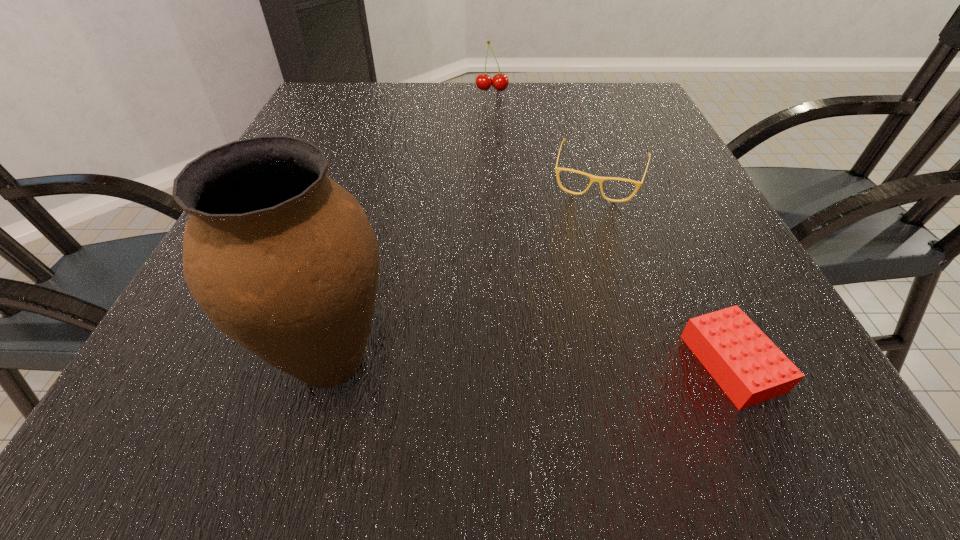
The image size is (960, 540). Find the location of `empty location between the third object from right to left and the second farthest object`. empty location between the third object from right to left and the second farthest object is located at coordinates (546, 133).

You are a GUI agent. You are given a task and a screenshot of the screen. Output one action in this format:
    pyautogui.click(x=<x>, y=<y>)
    Task: Click on the free space between the Lego and the leftmost object
    The width and height of the screenshot is (960, 540).
    Given the screenshot: What is the action you would take?
    pyautogui.click(x=531, y=361)

Where is `free space between the leftmost object and the farthest object`? free space between the leftmost object and the farthest object is located at coordinates (412, 225).

Identify the location of free area in between the farthest object and the third nearest object. (546, 133).

Image resolution: width=960 pixels, height=540 pixels. I want to click on empty space that is in between the cherry and the Lego, so click(x=612, y=226).

At what (x,y) coordinates should I click in order to perform the action: click on free area in between the tallest object and the cherry. Please return your answer as a coordinate pair (x, y). Looking at the image, I should click on (412, 225).

The image size is (960, 540). What are the coordinates of `empty location between the Lego and the urn` in the screenshot? It's located at (531, 361).

Identify the location of the closest object to the third nearest object. (747, 365).

Locate which object is the second closest to the Lego. Please provide its 2D coordinates. Your answer should be formatted as a tuple, i.e. [(x, y)], where the tuple contains the x and y coordinates of a point satisfying the conditions above.

[(284, 260)]

Find the location of a particular element. Image resolution: width=960 pixels, height=540 pixels. blank area in the image that satisfies the following two spatial constraints: 1. on the front side of the spectacles; 2. on the left side of the farthest object is located at coordinates coord(496,177).